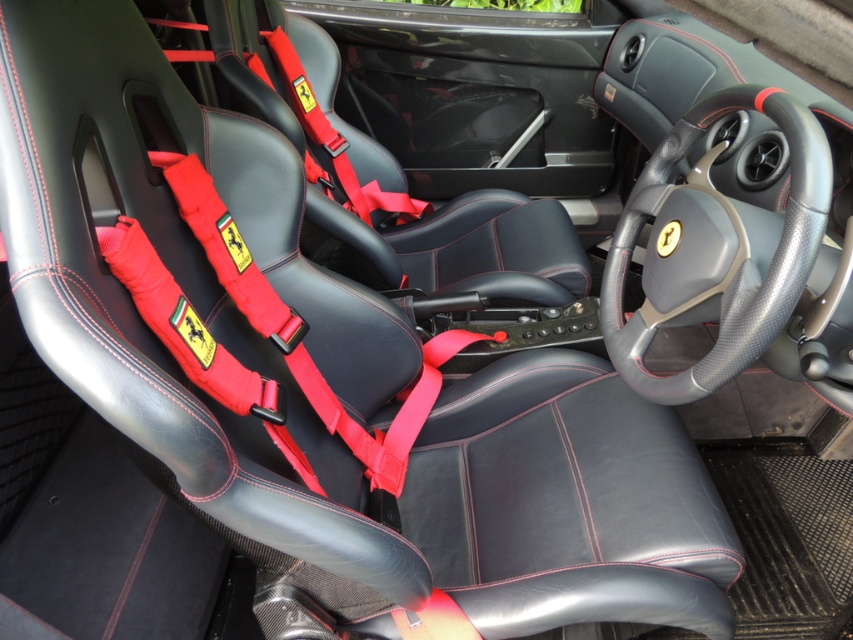
You are a race car driver preparing to enter the car. You need to locate the carbon fiber steering wheel at center. Where is it positioned in the car?

The carbon fiber steering wheel at center is positioned at point 2D coordinates of [715,250].

From the picture: You are sitting in the driver seat of the Ferrari sports car and want to reach two points inside the car. The first point is point (758, 292) and the second point is point (392, 205). Which point is closer to you?

Point (758, 292) is in front of point (392, 205), so the second point is closer to you.

Consider the image. You are a car designer evaluating the interior space of this Ferrari. You need to ensure that the carbon fiber steering wheel at center and the black leather seat at center do not interfere with each other. Based on their sizes, which object might require more space in the cockpit?

The black leather seat at center requires more space in the cockpit because it is larger than the carbon fiber steering wheel at center.